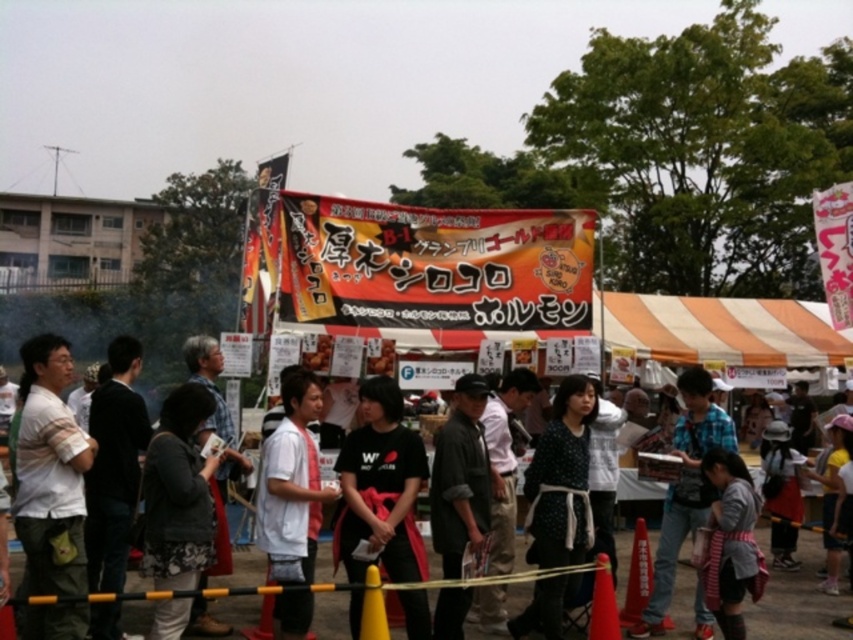
Does black matte shirt at center appear under dark gray fabric apron at lower right?

Incorrect, black matte shirt at center is not positioned below dark gray fabric apron at lower right.

Is point (335, 524) behind point (741, 516)?

Yes, it is.

Who is more forward, (380, 408) or (711, 550)?

Point (711, 550)

Locate an element on the screen. black matte shirt at center is located at coordinates (380, 486).

Does white matte shirt at center appear on the left side of light blue shirt at center?

Indeed, white matte shirt at center is positioned on the left side of light blue shirt at center.

Where is `white matte shirt at center`? The height and width of the screenshot is (640, 853). white matte shirt at center is located at coordinates (292, 483).

Where is `white matte shirt at center`? white matte shirt at center is located at coordinates (292, 483).

Is point (668, 493) positioned in front of point (625, 595)?

No, (668, 493) is further to viewer.

Does light blue shirt at center have a greater width compared to orange matte traffic cone at lower center?

Correct, the width of light blue shirt at center exceeds that of orange matte traffic cone at lower center.

In order to click on light blue shirt at center in this screenshot , I will do `click(685, 488)`.